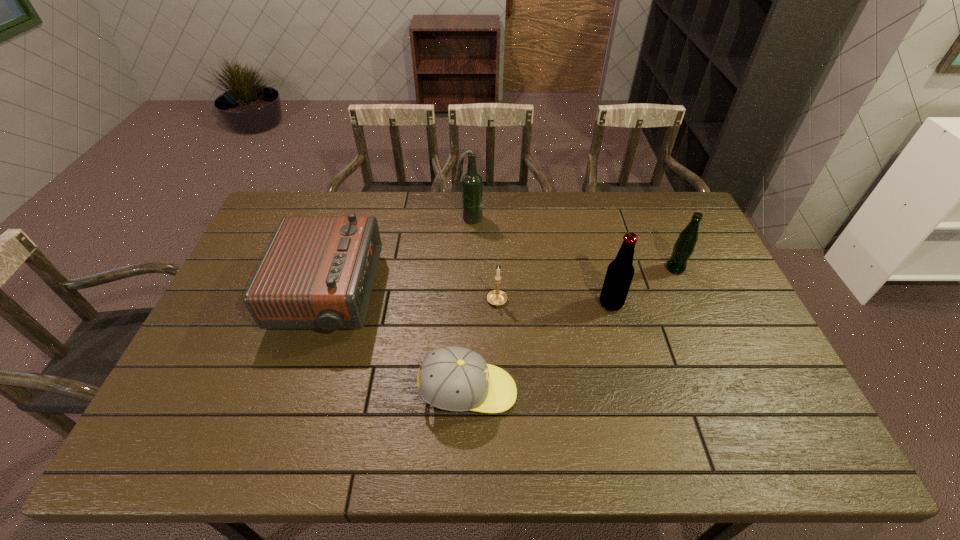
Locate an element on the screen. The width and height of the screenshot is (960, 540). the farthest object is located at coordinates (472, 185).

The width and height of the screenshot is (960, 540). In order to click on the leftmost beer bottle in this screenshot , I will do `click(472, 185)`.

Identify the location of the second beer bottle from right to left. Image resolution: width=960 pixels, height=540 pixels. (620, 272).

Locate an element on the screen. The width and height of the screenshot is (960, 540). the nearest beer bottle is located at coordinates (620, 272).

Image resolution: width=960 pixels, height=540 pixels. Identify the location of the shortest beer bottle. (684, 246).

Locate an element on the screen. the rightmost object is located at coordinates (684, 246).

Identify the location of the leftmost object. (318, 272).

Locate an element on the screen. The height and width of the screenshot is (540, 960). candle holder is located at coordinates (497, 297).

Locate an element on the screen. Image resolution: width=960 pixels, height=540 pixels. the nearest object is located at coordinates coord(457,379).

Find the location of `free space located 0.220m on the front of the farthest beer bottle`. free space located 0.220m on the front of the farthest beer bottle is located at coordinates (468, 269).